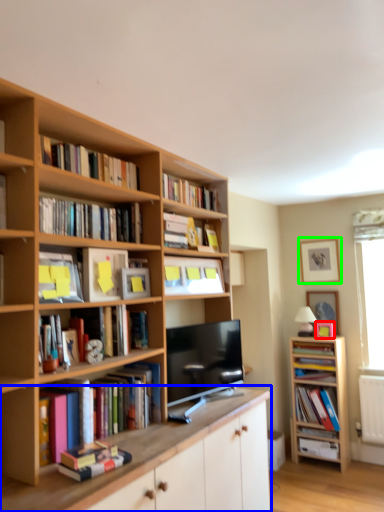
Question: Estimate the real-world distances between objects in this image. Which object is farther from picture frame (highlighted by a red box), cabinetry (highlighted by a blue box) or picture frame (highlighted by a green box)?

Choices:
 (A) cabinetry
 (B) picture frame

Answer: (A)